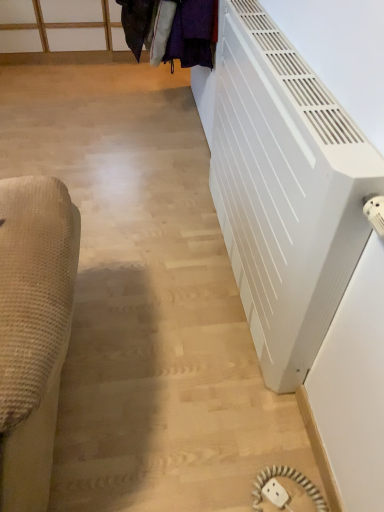
Question: From the image's perspective, relative to white matte radiator at right, is velvet purple coat at upper center above or below?

Choices:
 (A) above
 (B) below

Answer: (A)

Question: From a real-world perspective, relative to white matte radiator at right, is velvet purple coat at upper center vertically above or below?

Choices:
 (A) above
 (B) below

Answer: (A)

Question: Considering the real-world distances, which object is farthest from the white plastic outlet at lower right?

Choices:
 (A) velvet purple coat at upper center
 (B) white matte radiator at right

Answer: (A)

Question: Which object is the farthest from the white matte radiator at right?

Choices:
 (A) velvet purple coat at upper center
 (B) white plastic outlet at lower right

Answer: (B)